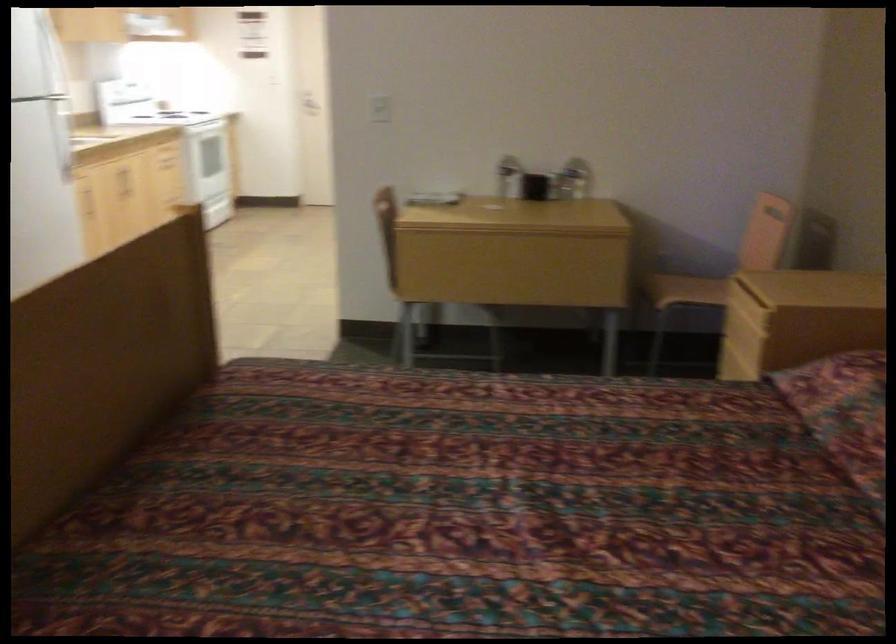
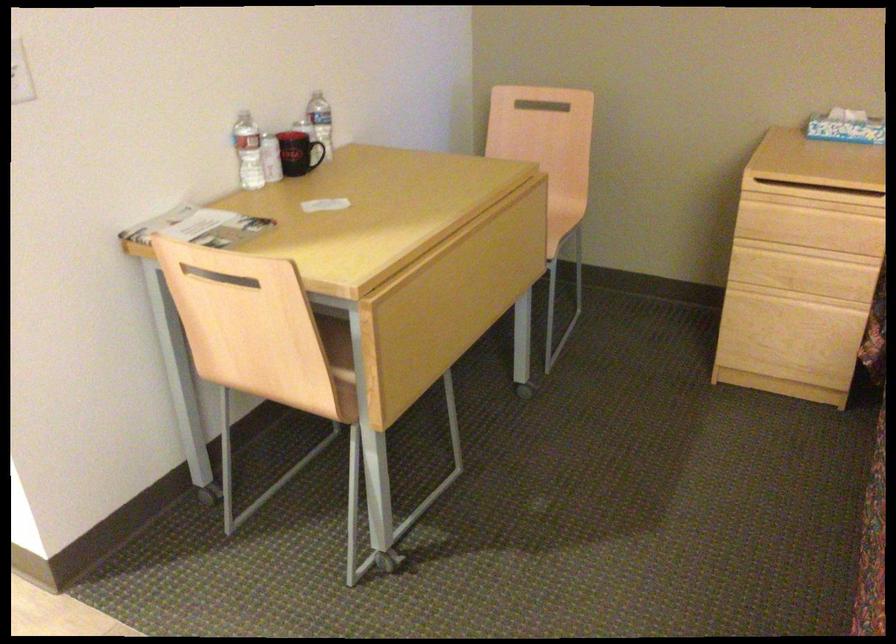
Locate, in the second image, the point that corresponds to pixel 745 351 in the first image.

(810, 251)